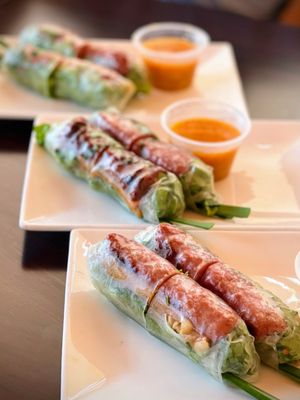
Locate an element on the screen. chopsticks is located at coordinates [x=256, y=389], [x=293, y=369], [x=200, y=223], [x=237, y=213].